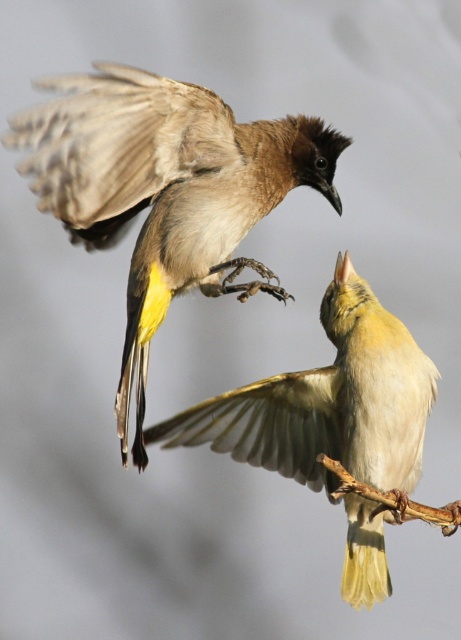
You are a nature photographer observing the scene. You want to capture a photo where the light brown feathered bird at center is in focus while the brown feathered wing at upper left is slightly blurred. Is this possible given their positions?

Yes, because the light brown feathered bird at center is closer to the viewer than the brown feathered wing at upper left, adjusting the camera focus on the closer bird would naturally blur the background elements like the wing.